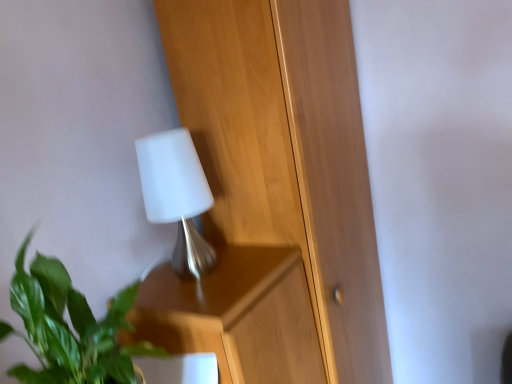
Question: Considering the positions of wooden dresser at center and white matte lamp at upper center in the image, is wooden dresser at center bigger or smaller than white matte lamp at upper center?

Choices:
 (A) big
 (B) small

Answer: (A)

Question: Is point (273, 223) positioned closer to the camera than point (201, 185)?

Choices:
 (A) farther
 (B) closer

Answer: (A)

Question: Which object is positioned closest to the white matte lamp at upper center?

Choices:
 (A) green leafy plant at lower left
 (B) wooden dresser at center

Answer: (B)

Question: Which of these objects is positioned closest to the white matte lamp at upper center?

Choices:
 (A) wooden dresser at center
 (B) green leafy plant at lower left

Answer: (A)